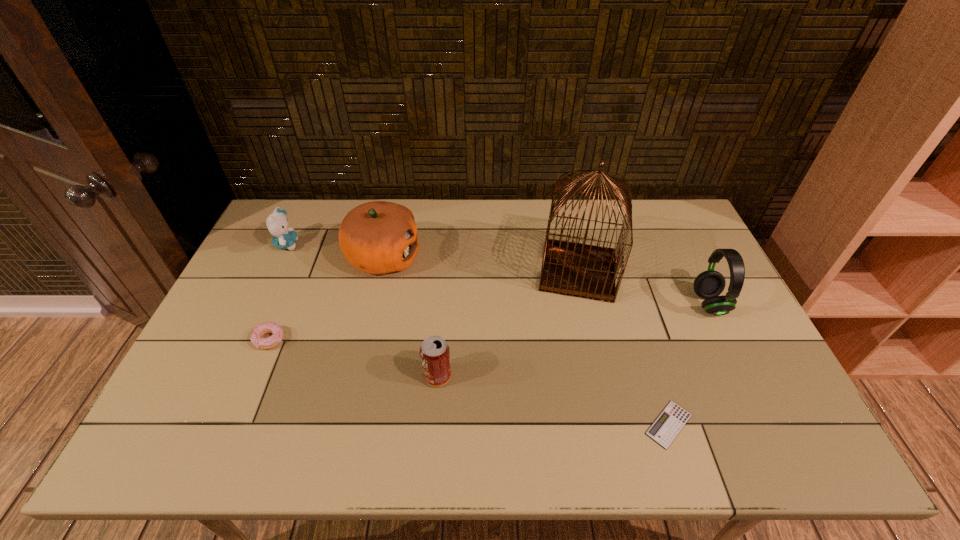
Where is `vacant region located 0.210m on the front of the birdcage`? The image size is (960, 540). vacant region located 0.210m on the front of the birdcage is located at coordinates (599, 364).

Locate an element on the screen. This screenshot has height=540, width=960. vacant region located 0.390m on the face of the fifth object from right to left is located at coordinates (540, 258).

At what (x,y) coordinates should I click in order to perform the action: click on vacant space positioned 0.250m on the ear cups of the rightmost object. Please return your answer as a coordinate pair (x, y). The width and height of the screenshot is (960, 540). Looking at the image, I should click on (609, 303).

You are a GUI agent. You are given a task and a screenshot of the screen. Output one action in this format:
    pyautogui.click(x=<x>, y=<y>)
    Task: Click on the free space located on the ear cups of the rightmost object
    This screenshot has height=540, width=960.
    Given the screenshot: What is the action you would take?
    pyautogui.click(x=629, y=303)

What are the coordinates of `free region located 0.340m on the ear cups of the rightmost object` in the screenshot? It's located at (578, 303).

Find the location of a particular element. The image size is (960, 540). free region located 0.240m on the face of the kitten is located at coordinates (371, 245).

You are a GUI agent. You are given a task and a screenshot of the screen. Output one action in this format:
    pyautogui.click(x=<x>, y=<y>)
    Task: Click on the free location located on the back of the fourth object from left to right
    Image resolution: width=960 pixels, height=540 pixels.
    Given the screenshot: What is the action you would take?
    pyautogui.click(x=440, y=342)

Identify the location of blank area located 0.170m on the back of the fifth farthest object. (293, 284).

This screenshot has width=960, height=540. Find the location of `free point located on the right of the nearest object`. free point located on the right of the nearest object is located at coordinates (751, 424).

Where is `pumpkin that is at the far edge`? The height and width of the screenshot is (540, 960). pumpkin that is at the far edge is located at coordinates (378, 237).